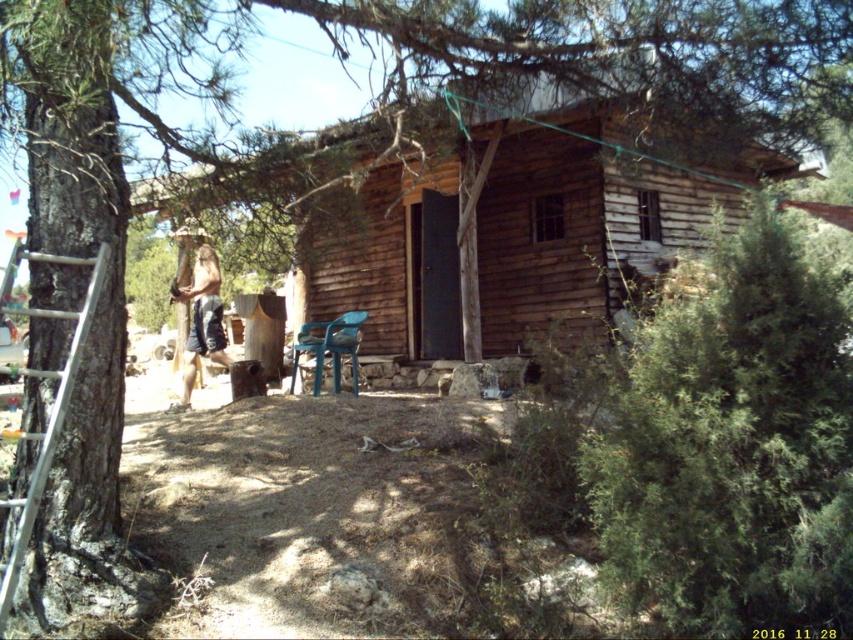
In the scene shown: You are planning to move the silver metallic ladder at left closer to the wooden log cabin at center. Considering their widths, which object will occupy more space horizontally after moving?

The wooden log cabin at center has a greater width than the silver metallic ladder at left, so it will occupy more space horizontally after moving.

You are standing on the porch of the rustic wooden cabin and want to sit down. There is a silver metallic ladder at left and a blue plastic chair at center. Which object is closer to the ground?

The silver metallic ladder at left is below the blue plastic chair at center, so the silver metallic ladder at left is closer to the ground.